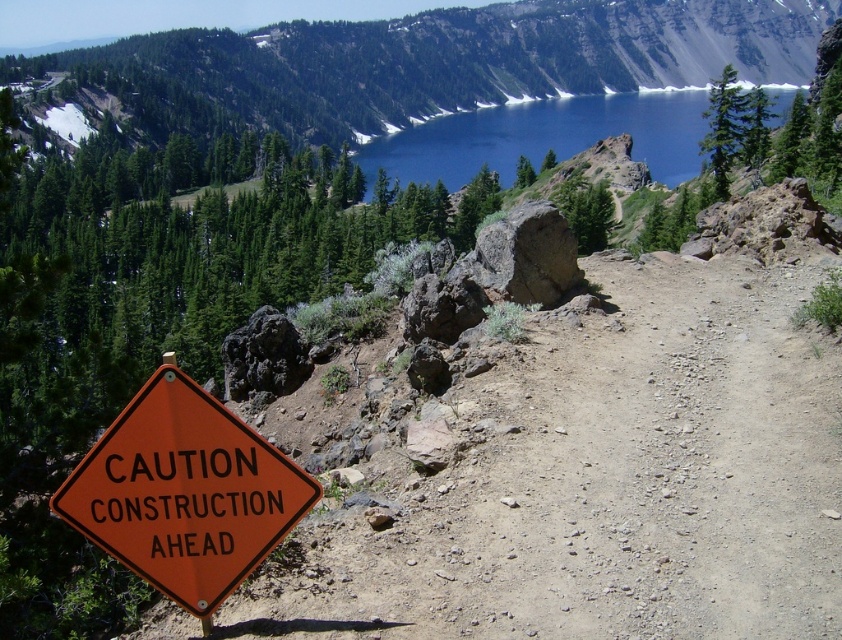
Who is positioned more to the left, orange plastic sign at lower left or blue glassy lake at upper center?

orange plastic sign at lower left

At what (x,y) coordinates should I click in order to perform the action: click on orange plastic sign at lower left. Please return your answer as a coordinate pair (x, y). This screenshot has height=640, width=842. Looking at the image, I should click on (184, 492).

Identify the location of orange plastic sign at lower left. The image size is (842, 640). (184, 492).